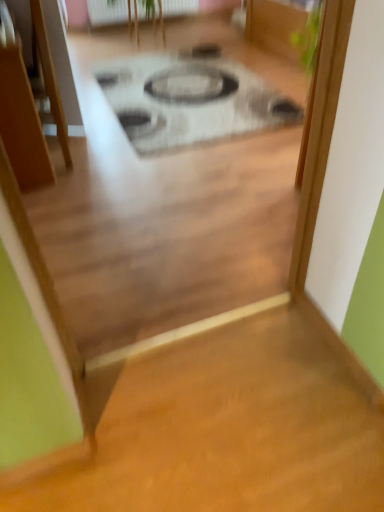
What do you see at coordinates (189, 101) in the screenshot? The height and width of the screenshot is (512, 384). I see `white textured rug at center` at bounding box center [189, 101].

Image resolution: width=384 pixels, height=512 pixels. Identify the location of white textured rug at center. (189, 101).

This screenshot has width=384, height=512. In order to click on white textured rug at center in this screenshot , I will do `click(189, 101)`.